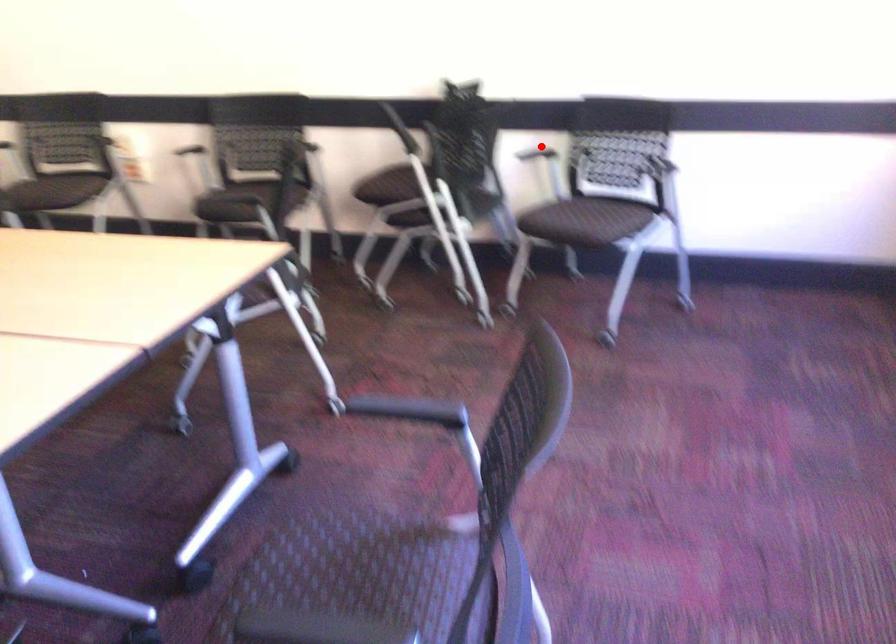
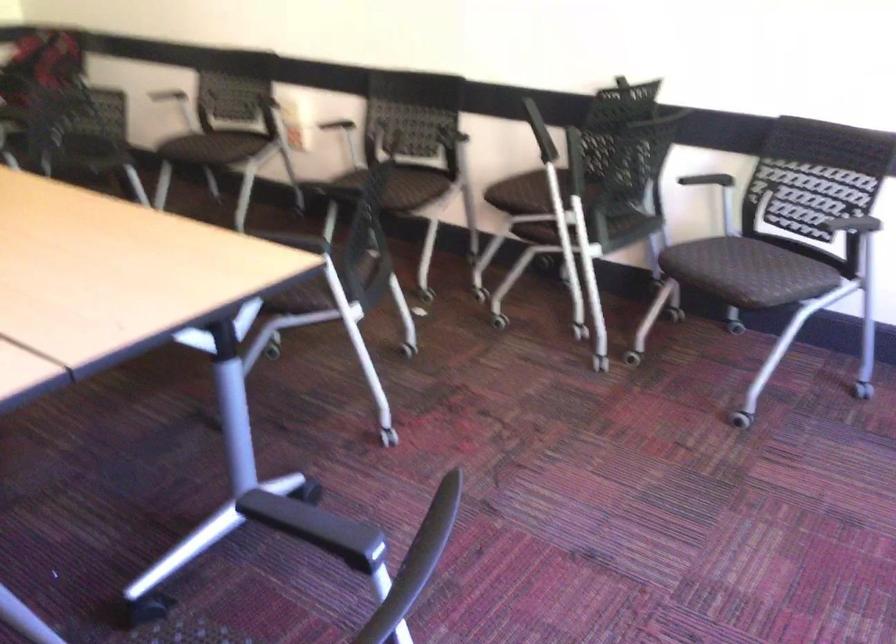
The point at the highlighted location is marked in the first image. Where is the corresponding point in the second image?

(718, 169)